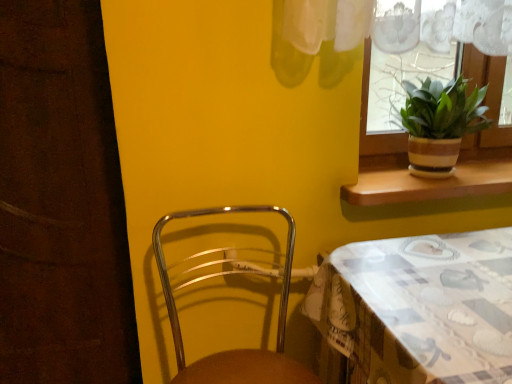
This screenshot has width=512, height=384. I want to click on patterned fabric table at lower right, so click(420, 307).

Locate an element on the screen. Image resolution: width=512 pixels, height=384 pixels. metallic brown chair at lower left is located at coordinates (240, 349).

What do you see at coordinates (240, 349) in the screenshot? Image resolution: width=512 pixels, height=384 pixels. I see `metallic brown chair at lower left` at bounding box center [240, 349].

Where is `green striped pot at window`? green striped pot at window is located at coordinates (440, 123).

Identify the location of patterned fabric table at lower right. This screenshot has height=384, width=512. (420, 307).

Is metallic brown chair at lower left in contact with green striped pot at window?

There is a gap between metallic brown chair at lower left and green striped pot at window.

Which is more distant, (311, 373) or (463, 81)?

The point (463, 81) is farther.

Is metallic brown chair at lower left facing towards green striped pot at window?

No, metallic brown chair at lower left is not aimed at green striped pot at window.

Where is `houseplant lying above the metallic brown chair at lower left (from the image's perspective)`? houseplant lying above the metallic brown chair at lower left (from the image's perspective) is located at coordinates (440, 123).

Considering the sizes of brown wood at upper right and patterned fabric table at lower right in the image, is brown wood at upper right taller or shorter than patterned fabric table at lower right?

brown wood at upper right is shorter than patterned fabric table at lower right.

Is brown wood at upper right far away from patterned fabric table at lower right?

brown wood at upper right is actually quite close to patterned fabric table at lower right.

At what (x,y) coordinates should I click in order to perform the action: click on window sill above the patterned fabric table at lower right (from the image's perspective). Please return your answer as a coordinate pair (x, y). Looking at the image, I should click on point(430,184).

Which object is thinner, green striped pot at window or brown wood at upper right?

green striped pot at window is thinner.

Would you consider green striped pot at window to be distant from brown wood at upper right?

No, green striped pot at window is in close proximity to brown wood at upper right.

Who is smaller, green striped pot at window or brown wood at upper right?

brown wood at upper right is smaller.

Can you confirm if green striped pot at window is taller than brown wood at upper right?

Yes, green striped pot at window is taller than brown wood at upper right.

You are a GUI agent. You are given a task and a screenshot of the screen. Output one action in this format:
    pyautogui.click(x=<x>, y=<y>)
    Task: Click on the chair above the patterned fabric table at lower right (from a real-world perspective)
    
    Given the screenshot: What is the action you would take?
    pyautogui.click(x=240, y=349)

Can you confirm if patterned fabric table at lower right is positioned to the left of metallic brown chair at lower left?

No.

Are patterned fabric table at lower right and metallic brown chair at lower left far apart?

patterned fabric table at lower right is near metallic brown chair at lower left, not far away.

From the image's perspective, between patterned fabric table at lower right and metallic brown chair at lower left, which one is located above?

metallic brown chair at lower left appears higher in the image.

Can you tell me how much metallic brown chair at lower left and brown wood at upper right differ in facing direction?

metallic brown chair at lower left and brown wood at upper right are facing 0.00112 degrees away from each other.

Considering the sizes of objects metallic brown chair at lower left and brown wood at upper right in the image provided, who is taller, metallic brown chair at lower left or brown wood at upper right?

Standing taller between the two is metallic brown chair at lower left.

Is brown wood at upper right at the back of metallic brown chair at lower left?

metallic brown chair at lower left is not turned away from brown wood at upper right.

Considering the sizes of objects metallic brown chair at lower left and brown wood at upper right in the image provided, who is bigger, metallic brown chair at lower left or brown wood at upper right?

metallic brown chair at lower left.

Looking at this image, considering the sizes of objects brown wood at upper right and green striped pot at window in the image provided, who is thinner, brown wood at upper right or green striped pot at window?

green striped pot at window.

The height and width of the screenshot is (384, 512). I want to click on houseplant located above the brown wood at upper right (from the image's perspective), so click(x=440, y=123).

Is green striped pot at window at the back of brown wood at upper right?

No, brown wood at upper right is not facing the opposite direction of green striped pot at window.

Considering the relative positions of brown wood at upper right and green striped pot at window in the image provided, is brown wood at upper right to the left of green striped pot at window from the viewer's perspective?

In fact, brown wood at upper right is to the right of green striped pot at window.

From their relative heights in the image, would you say brown wood at upper right is taller or shorter than metallic brown chair at lower left?

In the image, brown wood at upper right appears to be shorter than metallic brown chair at lower left.

What's the angular difference between brown wood at upper right and metallic brown chair at lower left's facing directions?

The angle between the facing direction of brown wood at upper right and the facing direction of metallic brown chair at lower left is 0.00112 degrees.

Considering the relative sizes of brown wood at upper right and metallic brown chair at lower left in the image provided, is brown wood at upper right smaller than metallic brown chair at lower left?

Yes.

Is brown wood at upper right next to metallic brown chair at lower left?

brown wood at upper right and metallic brown chair at lower left are clearly separated.

Locate an element on the screen. houseplant above the metallic brown chair at lower left (from a real-world perspective) is located at coordinates (440, 123).

Where is `table located below the brown wood at upper right (from the image's perspective)`? table located below the brown wood at upper right (from the image's perspective) is located at coordinates pos(420,307).

Estimate the real-world distances between objects in this image. Which object is closer to metallic brown chair at lower left, patterned fabric table at lower right or brown wood at upper right?

Based on the image, patterned fabric table at lower right appears to be nearer to metallic brown chair at lower left.

Estimate the real-world distances between objects in this image. Which object is closer to brown wood at upper right, patterned fabric table at lower right or metallic brown chair at lower left?

patterned fabric table at lower right.

From the picture: Estimate the real-world distances between objects in this image. Which object is closer to metallic brown chair at lower left, green striped pot at window or brown wood at upper right?

Among the two, brown wood at upper right is located nearer to metallic brown chair at lower left.

Based on the photo, based on their spatial positions, is brown wood at upper right or green striped pot at window closer to metallic brown chair at lower left?

Among the two, brown wood at upper right is located nearer to metallic brown chair at lower left.

Which object lies further to the anchor point green striped pot at window, metallic brown chair at lower left or brown wood at upper right?

metallic brown chair at lower left is further to green striped pot at window.

Considering their positions, is brown wood at upper right positioned closer to green striped pot at window than patterned fabric table at lower right?

The object closer to green striped pot at window is brown wood at upper right.

Looking at the image, which one is located closer to brown wood at upper right, metallic brown chair at lower left or green striped pot at window?

The object closer to brown wood at upper right is green striped pot at window.

In the scene shown: Based on their spatial positions, is brown wood at upper right or metallic brown chair at lower left closer to green striped pot at window?

brown wood at upper right lies closer to green striped pot at window than the other object.

Locate an element on the screen. This screenshot has width=512, height=384. chair between patterned fabric table at lower right and brown wood at upper right in the front-back direction is located at coordinates (240, 349).

What are the coordinates of `chair between green striped pot at window and patterned fabric table at lower right in the up-down direction` in the screenshot? It's located at (240, 349).

Locate an element on the screen. This screenshot has height=384, width=512. houseplant located between metallic brown chair at lower left and brown wood at upper right in the left-right direction is located at coordinates (440, 123).

The height and width of the screenshot is (384, 512). I want to click on houseplant between patterned fabric table at lower right and brown wood at upper right from front to back, so click(440, 123).